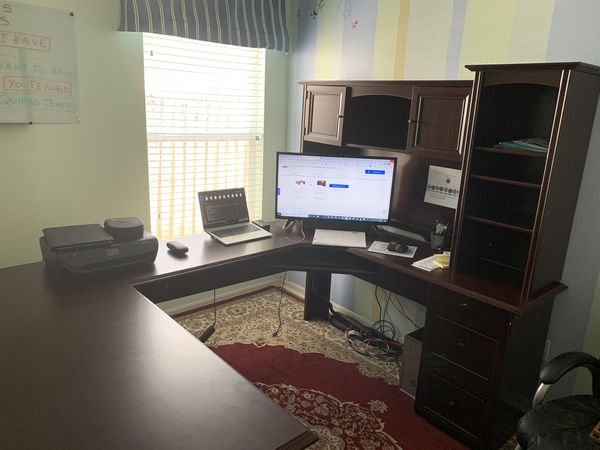
This screenshot has height=450, width=600. I want to click on computer mouse, so click(x=400, y=246).